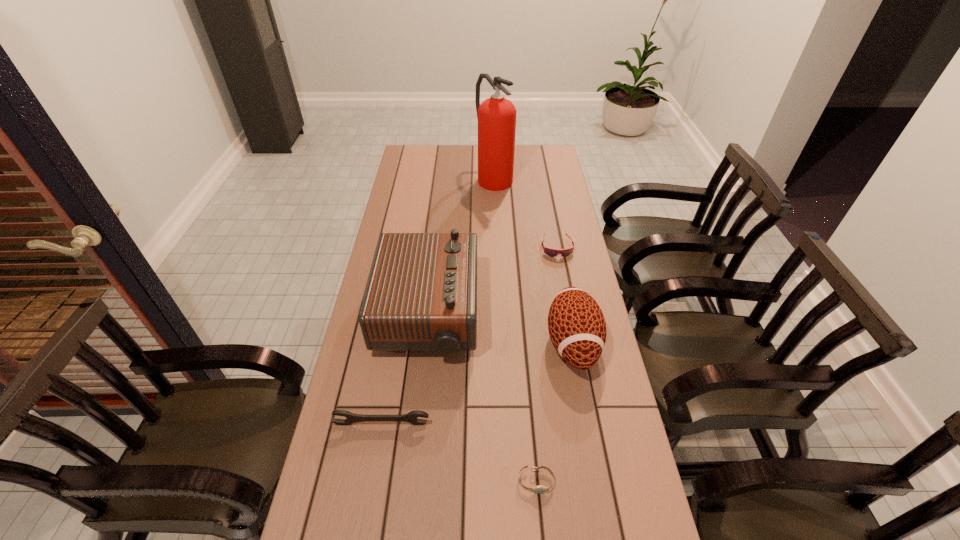
Find the location of a particular element. the tallest object is located at coordinates (496, 116).

Where is `fire extinguisher`? The height and width of the screenshot is (540, 960). fire extinguisher is located at coordinates (496, 116).

The width and height of the screenshot is (960, 540). I want to click on the second tallest object, so click(421, 294).

The height and width of the screenshot is (540, 960). I want to click on the third tallest object, so click(x=576, y=324).

You are a GUI agent. You are given a task and a screenshot of the screen. Output one action in this format:
    pyautogui.click(x=<x>, y=<y>)
    Task: Click on the fifth farthest object
    The height and width of the screenshot is (540, 960).
    Given the screenshot: What is the action you would take?
    pyautogui.click(x=412, y=417)

This screenshot has width=960, height=540. I want to click on wrench, so click(412, 417).

Locate an element on the screen. This screenshot has width=960, height=540. goggles is located at coordinates (551, 252).

Find the location of a particular element. the fifth tallest object is located at coordinates (551, 252).

Where is `watch`? watch is located at coordinates (536, 489).

Where is `the shortest object`? This screenshot has height=540, width=960. the shortest object is located at coordinates (536, 489).